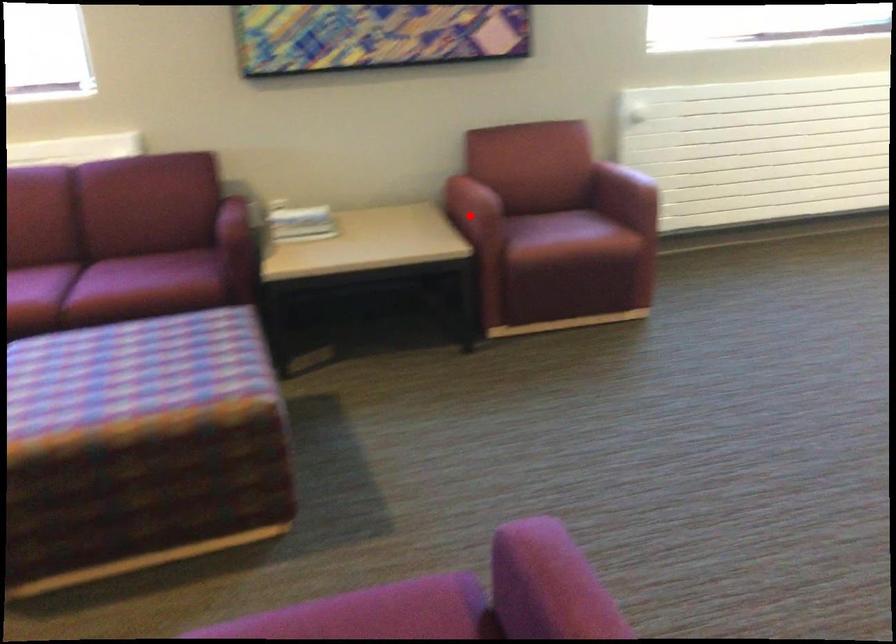
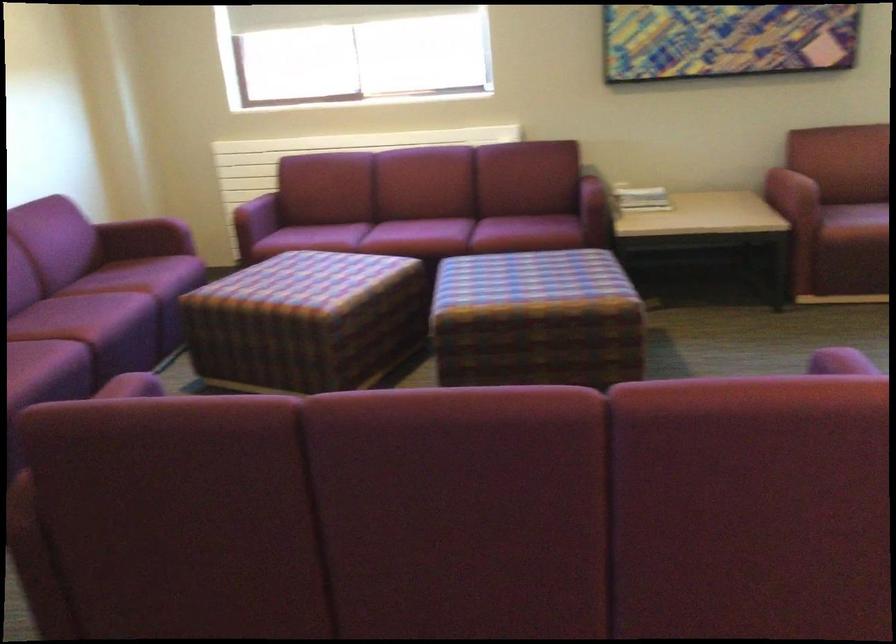
Locate, in the second image, the point that corresponds to the highlighted location in the first image.

(791, 194)